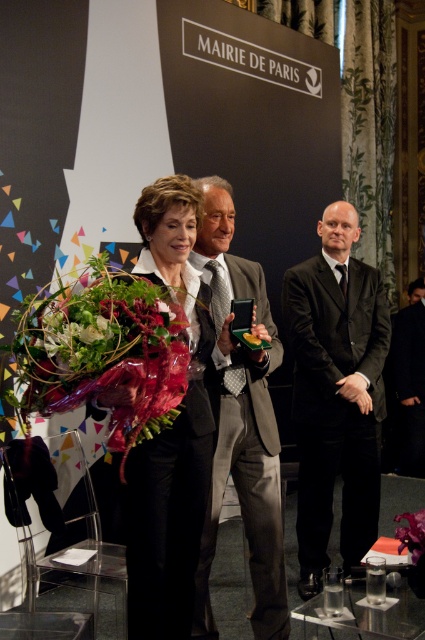
Question: Which point is farther to the camera?

Choices:
 (A) gray suit at center
 (B) green leafy bouquet at center
 (C) matte silver phone at center

Answer: (A)

Question: Which of the following is the farthest from the observer?

Choices:
 (A) green leafy bouquet at center
 (B) gray suit at center
 (C) matte black suit at center
 (D) black suit at center

Answer: (D)

Question: Does black suit at center appear under matte silver phone at center?

Choices:
 (A) yes
 (B) no

Answer: (A)

Question: Based on their relative distances, which object is nearer to the gray suit at center?

Choices:
 (A) black suit at center
 (B) green leafy bouquet at center
 (C) translucent plastic bouquet at left
 (D) matte silver phone at center

Answer: (D)

Question: Does matte black suit at center have a larger size compared to gray suit at center?

Choices:
 (A) no
 (B) yes

Answer: (A)

Question: From the image, what is the correct spatial relationship of gray suit at center in relation to green leafy bouquet at center?

Choices:
 (A) right
 (B) left

Answer: (A)